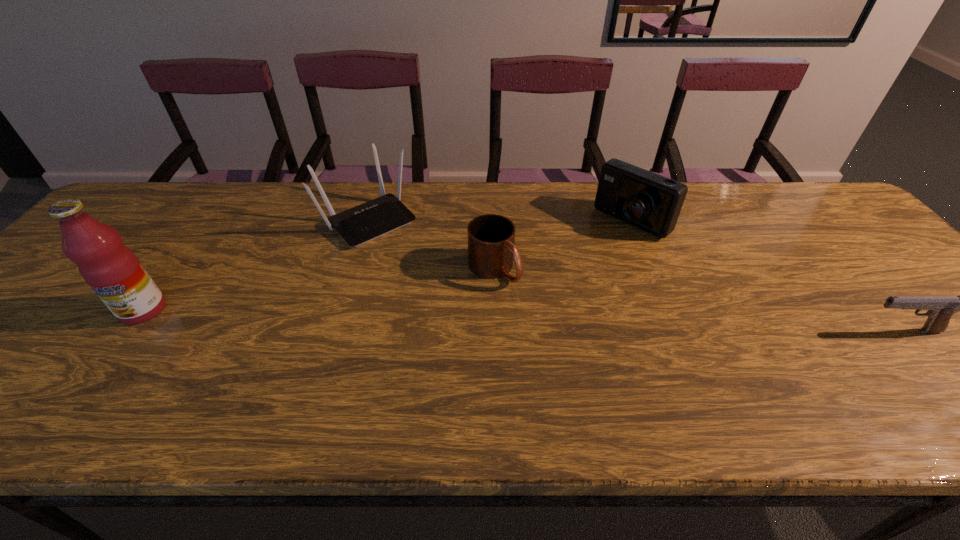
The height and width of the screenshot is (540, 960). In order to click on free spot on the desktop that is between the tallest object and the rightmost object and is positioned on the front-facing side of the second object from left to right in this screenshot , I will do `click(469, 319)`.

Find the location of a particular element. free space on the desktop that is between the fruit juice and the pistol and is positioned on the front-facing side of the camera is located at coordinates (502, 320).

Locate an element on the screen. free space on the desktop that is between the fourth farthest object and the nearest object and is positioned on the side of the mug with the handle is located at coordinates (551, 321).